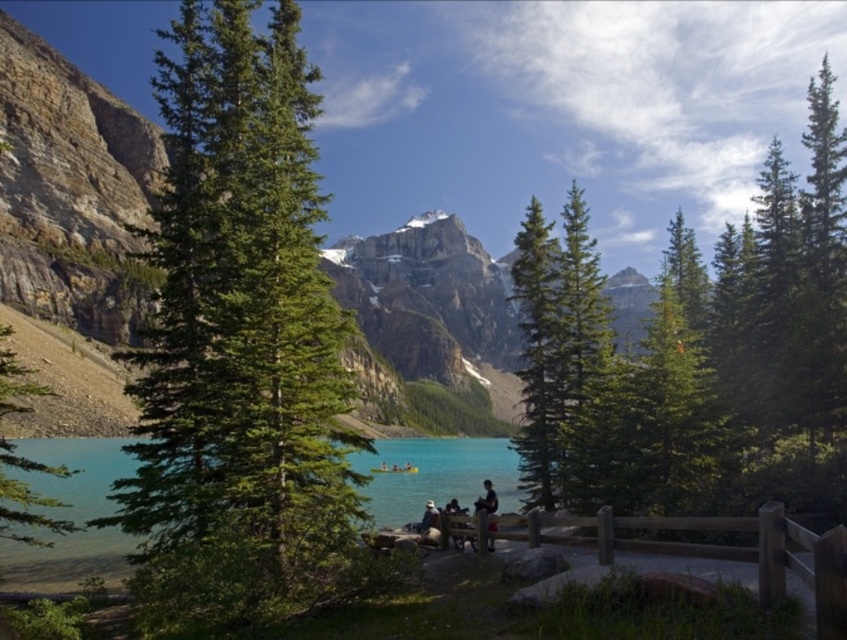
Between green matte tree at upper center and green matte tree at lower left, which one has more height?

green matte tree at upper center is taller.

Can you confirm if green matte tree at upper center is bigger than green matte tree at lower left?

Yes.

Who is more forward, (519, 272) or (39, 390)?

Point (39, 390)

At what (x,y) coordinates should I click in order to perform the action: click on green matte tree at upper center. Please return your answer as a coordinate pair (x, y). The width and height of the screenshot is (847, 640). Looking at the image, I should click on (698, 355).

Does green textured tree at left appear under green matte tree at lower left?

Actually, green textured tree at left is above green matte tree at lower left.

Does green textured tree at left appear on the right side of green matte tree at lower left?

Correct, you'll find green textured tree at left to the right of green matte tree at lower left.

What do you see at coordinates (241, 348) in the screenshot? This screenshot has width=847, height=640. I see `green textured tree at left` at bounding box center [241, 348].

This screenshot has height=640, width=847. In order to click on green textured tree at left in this screenshot , I will do `click(241, 348)`.

Between green matte tree at center and green matte tree at lower left, which one is positioned lower?

Positioned lower is green matte tree at lower left.

Is point (518, 308) less distant than point (3, 356)?

No, it is behind (3, 356).

Image resolution: width=847 pixels, height=640 pixels. What are the coordinates of `green matte tree at center` in the screenshot? It's located at (537, 356).